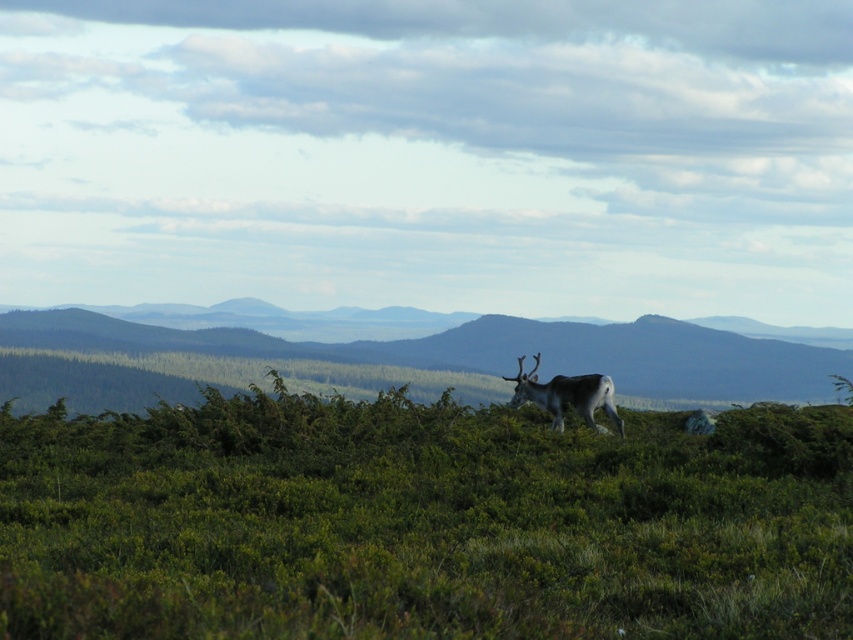
Question: Which of the following is the farthest from the observer?

Choices:
 (A) grayish-brown fur deer at center
 (B) green grassy hillside at center

Answer: (B)

Question: Does green grassy hillside at center appear on the left side of grayish-brown fur deer at center?

Choices:
 (A) no
 (B) yes

Answer: (A)

Question: Can you confirm if green grassy hillside at center is smaller than grayish-brown fur deer at center?

Choices:
 (A) no
 (B) yes

Answer: (A)

Question: Among these points, which one is farthest from the camera?

Choices:
 (A) (573, 342)
 (B) (560, 392)

Answer: (A)

Question: Is green grassy hillside at center bigger than grayish-brown fur deer at center?

Choices:
 (A) no
 (B) yes

Answer: (B)